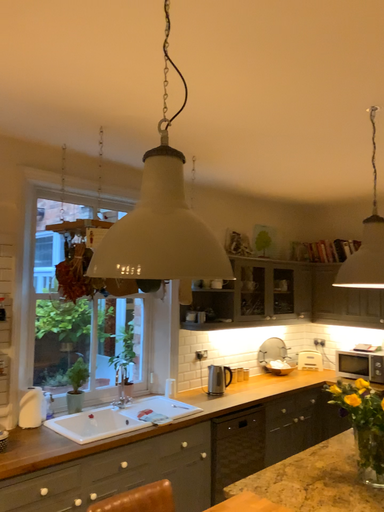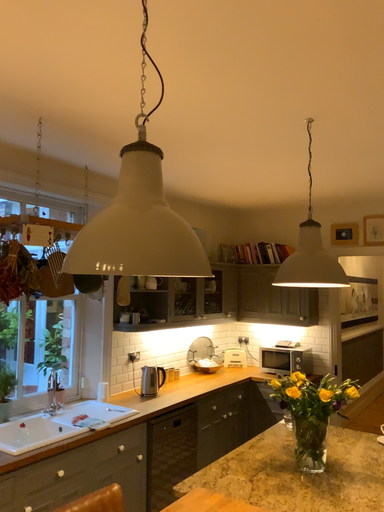
Question: How did the camera likely rotate when shooting the video?

Choices:
 (A) rotated left
 (B) rotated right

Answer: (B)